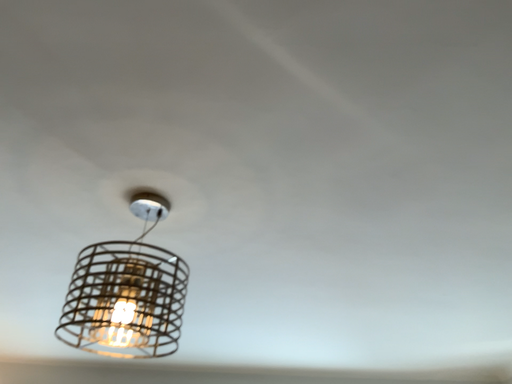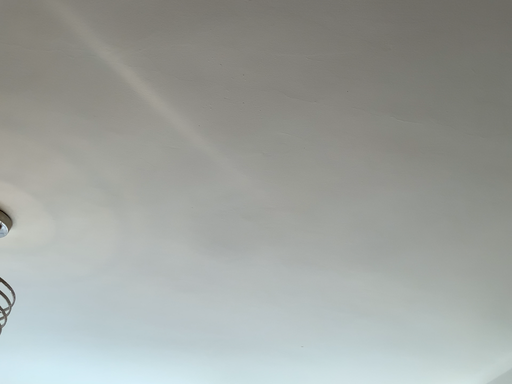
Question: How did the camera likely rotate when shooting the video?

Choices:
 (A) rotated right
 (B) rotated left

Answer: (A)